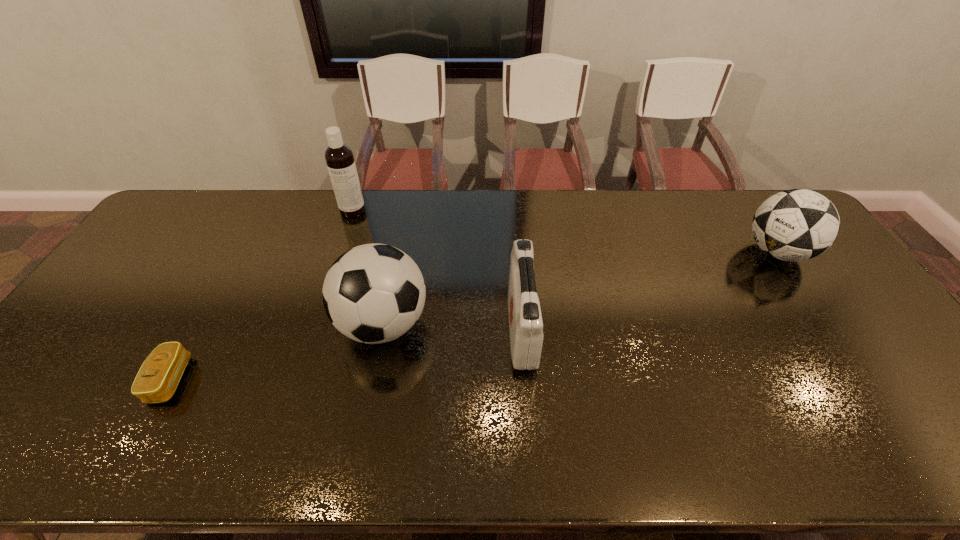
You are a GUI agent. You are given a task and a screenshot of the screen. Output one action in this format:
    pyautogui.click(x=<x>, y=<y>)
    Task: Click on the vacant space positioned 0.070m on the back of the third object from right to left
    Image resolution: width=960 pixels, height=540 pixels.
    Given the screenshot: What is the action you would take?
    pyautogui.click(x=393, y=273)

At what (x,y) coordinates should I click in order to perform the action: click on free space located 0.070m on the surface of the right soccer ball where the brand logo is visible. Please return your answer as a coordinate pair (x, y). The image size is (960, 540). Looking at the image, I should click on (721, 252).

This screenshot has height=540, width=960. I want to click on free location located on the surface of the right soccer ball where the brand logo is visible, so click(667, 252).

You are a GUI agent. You are given a task and a screenshot of the screen. Output one action in this format:
    pyautogui.click(x=<x>, y=<y>)
    Task: Click on the free region located 0.170m on the surface of the right soccer ball where the brand logo is visible
    Image resolution: width=960 pixels, height=540 pixels.
    Given the screenshot: What is the action you would take?
    pyautogui.click(x=689, y=252)

Identify the location of free space located on the front side of the fourth object from left to right. This screenshot has width=960, height=540. (387, 329).

At what (x,y) coordinates should I click in order to perform the action: click on blank area located on the front side of the fourth object from left to right. Please return your answer as a coordinate pair (x, y). The image size is (960, 540). Looking at the image, I should click on pos(417,329).

Image resolution: width=960 pixels, height=540 pixels. I want to click on vacant area situated on the front side of the fourth object from left to right, so click(x=420, y=329).

Image resolution: width=960 pixels, height=540 pixels. I want to click on free point located 0.350m on the zipper side of the shortest object, so click(329, 380).

This screenshot has height=540, width=960. I want to click on dishwasher detergent positioned at the far edge, so click(x=339, y=157).

This screenshot has width=960, height=540. I want to click on soccer ball located in the far edge section of the desktop, so click(x=793, y=225).